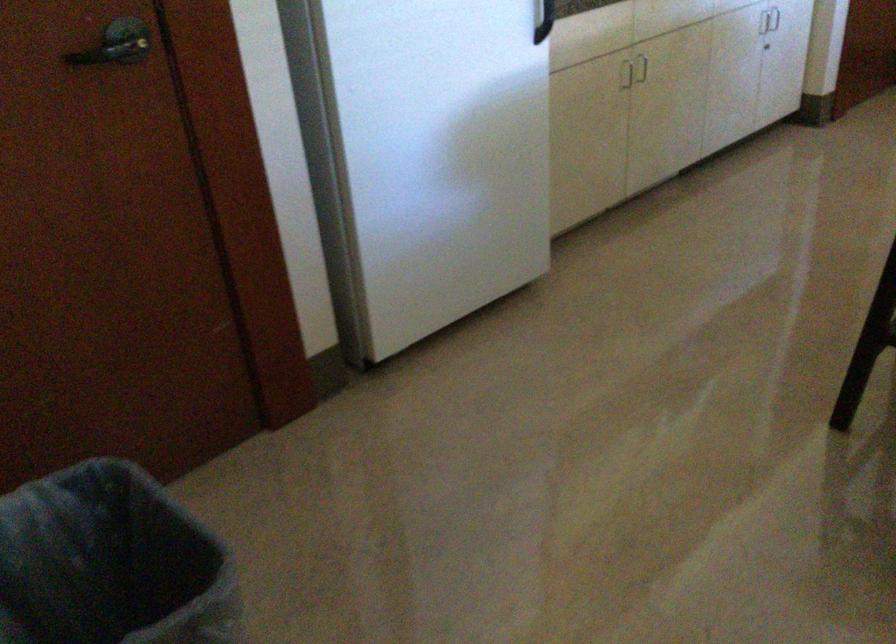
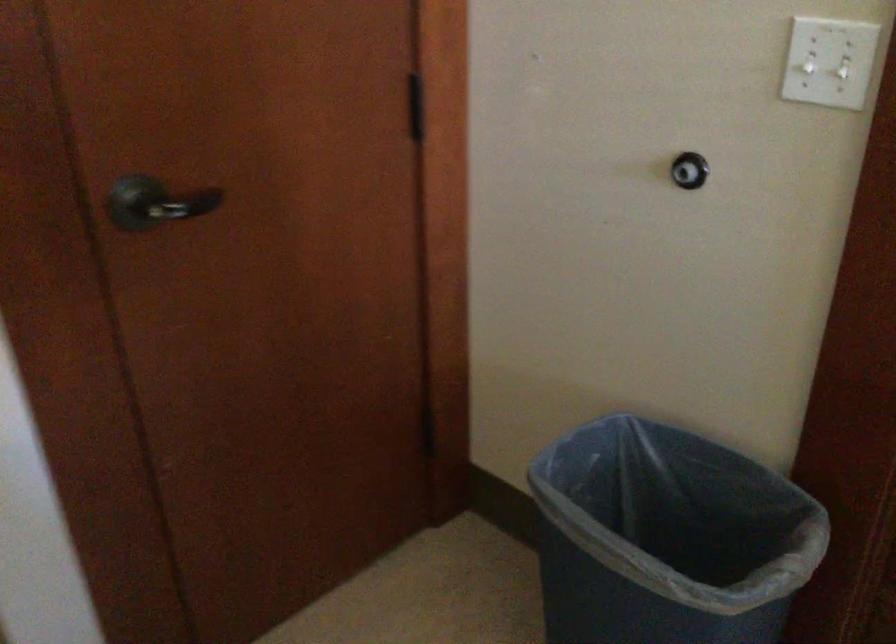
The images are taken continuously from a first-person perspective. In which direction are you moving?

The cameraman walked toward right, forward.